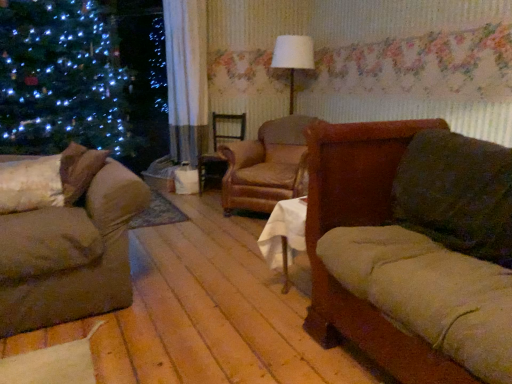
Question: Considering the relative sizes of white fabric lampshade at center and velvet brown couch at left, which is counted as the 2th studio couch, starting from the right, in the image provided, is white fabric lampshade at center shorter than velvet brown couch at left, which is counted as the 2th studio couch, starting from the right,?

Choices:
 (A) no
 (B) yes

Answer: (A)

Question: Can you confirm if white fabric lampshade at center is wider than velvet brown couch at left, which is counted as the 2th studio couch, starting from the right?

Choices:
 (A) yes
 (B) no

Answer: (B)

Question: Is white fabric lampshade at center positioned behind velvet brown couch at left, the first studio couch from the left?

Choices:
 (A) yes
 (B) no

Answer: (A)

Question: Could you tell me if white fabric lampshade at center is facing velvet brown couch at left, which is counted as the 2th studio couch, starting from the right?

Choices:
 (A) no
 (B) yes

Answer: (B)

Question: From the image's perspective, does white fabric lampshade at center appear higher than velvet brown couch at left, which is counted as the 2th studio couch, starting from the right?

Choices:
 (A) no
 (B) yes

Answer: (B)

Question: Is white fabric lampshade at center in front of or behind velvet brown couch at left, the first studio couch from the left, in the image?

Choices:
 (A) front
 (B) behind

Answer: (B)

Question: Does point (286, 46) appear closer or farther from the camera than point (71, 215)?

Choices:
 (A) farther
 (B) closer

Answer: (A)

Question: Looking at the image, does white fabric lampshade at center seem bigger or smaller compared to velvet brown couch at left, the first studio couch from the left?

Choices:
 (A) small
 (B) big

Answer: (A)

Question: From the image's perspective, relative to velvet brown couch at left, the first studio couch from the left, is white fabric lampshade at center above or below?

Choices:
 (A) above
 (B) below

Answer: (A)

Question: Is velvet brown couch at left, which is counted as the 2th studio couch, starting from the right, taller or shorter than white fabric lampshade at center?

Choices:
 (A) short
 (B) tall

Answer: (A)

Question: Considering the positions of velvet brown couch at left, the first studio couch from the left, and white fabric lampshade at center in the image, is velvet brown couch at left, the first studio couch from the left, wider or thinner than white fabric lampshade at center?

Choices:
 (A) wide
 (B) thin

Answer: (A)

Question: Considering the positions of point (113, 196) and point (290, 91), is point (113, 196) closer or farther from the camera than point (290, 91)?

Choices:
 (A) closer
 (B) farther

Answer: (A)

Question: Considering their positions, is velvet brown couch at left, which is counted as the 2th studio couch, starting from the right, located in front of or behind white fabric lampshade at center?

Choices:
 (A) front
 (B) behind

Answer: (A)

Question: Would you say leather armchair at center is to the left or to the right of brown leather swivel chair at center in the picture?

Choices:
 (A) left
 (B) right

Answer: (B)

Question: Is point (294, 180) closer or farther from the camera than point (238, 137)?

Choices:
 (A) closer
 (B) farther

Answer: (A)